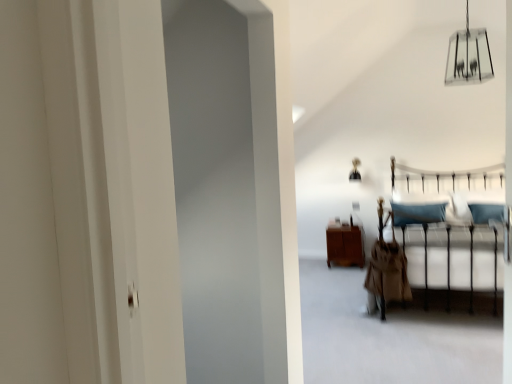
I want to click on clear glass chandelier at upper center, the first lamp viewed from the front, so click(x=468, y=56).

Locate an element on the screen. metallic gold lamp at upper center, which is the 1th lamp in back-to-front order is located at coordinates (355, 170).

Is brown wood cabinet at center looking in the opposite direction of metallic gold lamp at upper center, which is the 2th lamp from right to left?

That's not correct — brown wood cabinet at center is not looking away from metallic gold lamp at upper center, which is the 2th lamp from right to left.

From a real-world perspective, which is physically above, brown wood cabinet at center or metallic gold lamp at upper center, which is the 1th lamp in bottom-to-top order?

metallic gold lamp at upper center, which is the 1th lamp in bottom-to-top order, is physically above.

Considering the relative positions of brown wood cabinet at center and metallic gold lamp at upper center, the 2th lamp in the front-to-back sequence, in the image provided, is brown wood cabinet at center in front of metallic gold lamp at upper center, the 2th lamp in the front-to-back sequence,?

Yes, it is in front of metallic gold lamp at upper center, the 2th lamp in the front-to-back sequence.

This screenshot has height=384, width=512. I want to click on furniture on the left side of metallic gold lamp at upper center, which is the 1th lamp in back-to-front order, so click(x=345, y=244).

Which is nearer, (x=338, y=241) or (x=462, y=53)?

Point (x=338, y=241) is farther from the camera than point (x=462, y=53).

From a real-world perspective, count 2nd lamps upward from the brown wood cabinet at center and point to it. Please provide its 2D coordinates.

[(468, 56)]

Is brown wood cabinet at center positioned with its back to clear glass chandelier at upper center, the 2th lamp in the left-to-right sequence?

No.

Measure the distance from brown wood cabinet at center to clear glass chandelier at upper center, the 2th lamp viewed from the back.

brown wood cabinet at center is 7.55 feet from clear glass chandelier at upper center, the 2th lamp viewed from the back.

From a real-world perspective, is metallic gold lamp at upper center, which is the 2th lamp from right to left, over metallic silver bed frame at center?

Indeed, from a real-world perspective, metallic gold lamp at upper center, which is the 2th lamp from right to left, stands above metallic silver bed frame at center.

Considering the sizes of objects metallic gold lamp at upper center, which is the 1th lamp in back-to-front order, and metallic silver bed frame at center in the image provided, who is thinner, metallic gold lamp at upper center, which is the 1th lamp in back-to-front order, or metallic silver bed frame at center?

metallic gold lamp at upper center, which is the 1th lamp in back-to-front order.

Considering the positions of objects metallic gold lamp at upper center, positioned as the first lamp in left-to-right order, and metallic silver bed frame at center in the image provided, who is more to the right, metallic gold lamp at upper center, positioned as the first lamp in left-to-right order, or metallic silver bed frame at center?

Positioned to the right is metallic silver bed frame at center.

From the image's perspective, which object appears higher, metallic gold lamp at upper center, positioned as the first lamp in left-to-right order, or metallic silver bed frame at center?

metallic gold lamp at upper center, positioned as the first lamp in left-to-right order, from the image's perspective.

Could you tell me if metallic gold lamp at upper center, positioned as the first lamp in left-to-right order, is turned towards clear glass chandelier at upper center, the 2th lamp in the left-to-right sequence?

No, metallic gold lamp at upper center, positioned as the first lamp in left-to-right order, is not turned towards clear glass chandelier at upper center, the 2th lamp in the left-to-right sequence.

Considering the relative sizes of metallic gold lamp at upper center, the 2th lamp in the front-to-back sequence, and clear glass chandelier at upper center, arranged as the 1th lamp when viewed from the right, in the image provided, is metallic gold lamp at upper center, the 2th lamp in the front-to-back sequence, shorter than clear glass chandelier at upper center, arranged as the 1th lamp when viewed from the right,?

Yes.

At what (x,y) coordinates should I click in order to perform the action: click on lamp that appears on the left of clear glass chandelier at upper center, the 1th lamp in the top-to-bottom sequence. Please return your answer as a coordinate pair (x, y). The height and width of the screenshot is (384, 512). Looking at the image, I should click on (355, 170).

Which object is positioned more to the left, metallic gold lamp at upper center, positioned as the first lamp in left-to-right order, or clear glass chandelier at upper center, the 2th lamp in the left-to-right sequence?

From the viewer's perspective, metallic gold lamp at upper center, positioned as the first lamp in left-to-right order, appears more on the left side.

Can you confirm if clear glass chandelier at upper center, arranged as the 1th lamp when viewed from the right, is smaller than metallic silver bed frame at center?

Yes, clear glass chandelier at upper center, arranged as the 1th lamp when viewed from the right, is smaller than metallic silver bed frame at center.

Identify the location of bed frame on the right of clear glass chandelier at upper center, the 1th lamp in the top-to-bottom sequence. (452, 258).

How different are the orientations of clear glass chandelier at upper center, arranged as the 1th lamp when viewed from the right, and metallic silver bed frame at center in degrees?

3.72 degrees separate the facing orientations of clear glass chandelier at upper center, arranged as the 1th lamp when viewed from the right, and metallic silver bed frame at center.

Based on the photo, are clear glass chandelier at upper center, the 2th lamp in the left-to-right sequence, and brown wood cabinet at center far apart?

Indeed, clear glass chandelier at upper center, the 2th lamp in the left-to-right sequence, is not near brown wood cabinet at center.

From a real-world perspective, which object stands above the other?

In real-world perspective, clear glass chandelier at upper center, arranged as the second lamp when ordered from the bottom, is above.

Does point (481, 54) appear closer or farther from the camera than point (337, 253)?

Point (481, 54).

In order to click on lamp in front of the brown wood cabinet at center in this screenshot , I will do `click(468, 56)`.

Is metallic silver bed frame at center facing away from brown wood cabinet at center?

No.

Is metallic silver bed frame at center far away from brown wood cabinet at center?

Yes, metallic silver bed frame at center and brown wood cabinet at center are located far from each other.

Measure the distance from metallic silver bed frame at center to brown wood cabinet at center.

A distance of 1.83 meters exists between metallic silver bed frame at center and brown wood cabinet at center.

Considering the sizes of objects metallic silver bed frame at center and brown wood cabinet at center in the image provided, who is thinner, metallic silver bed frame at center or brown wood cabinet at center?

brown wood cabinet at center is thinner.

At what (x,y) coordinates should I click in order to perform the action: click on furniture lying on the left of metallic gold lamp at upper center, the 2th lamp in the front-to-back sequence. Please return your answer as a coordinate pair (x, y). This screenshot has width=512, height=384. Looking at the image, I should click on (345, 244).

Where is `the 2nd lamp above the brown wood cabinet at center (from the image's perspective)`? the 2nd lamp above the brown wood cabinet at center (from the image's perspective) is located at coordinates (468, 56).

Considering their positions, is brown wood cabinet at center positioned further to metallic gold lamp at upper center, which appears as the second lamp when viewed from the top, than metallic silver bed frame at center?

Among the two, metallic silver bed frame at center is located further to metallic gold lamp at upper center, which appears as the second lamp when viewed from the top.

Based on the photo, based on their spatial positions, is clear glass chandelier at upper center, the 2th lamp in the left-to-right sequence, or brown wood cabinet at center closer to metallic silver bed frame at center?

brown wood cabinet at center is closer to metallic silver bed frame at center.

From the image, which object appears to be farther from metallic silver bed frame at center, metallic gold lamp at upper center, which is the 1th lamp in back-to-front order, or clear glass chandelier at upper center, the 2th lamp viewed from the back?

The object further to metallic silver bed frame at center is metallic gold lamp at upper center, which is the 1th lamp in back-to-front order.

Estimate the real-world distances between objects in this image. Which object is further from metallic silver bed frame at center, clear glass chandelier at upper center, the 2th lamp in the left-to-right sequence, or metallic gold lamp at upper center, which appears as the second lamp when viewed from the top?

The object further to metallic silver bed frame at center is metallic gold lamp at upper center, which appears as the second lamp when viewed from the top.

Considering their positions, is metallic silver bed frame at center positioned further to clear glass chandelier at upper center, arranged as the second lamp when ordered from the bottom, than brown wood cabinet at center?

Among the two, brown wood cabinet at center is located further to clear glass chandelier at upper center, arranged as the second lamp when ordered from the bottom.

Which object lies further to the anchor point metallic gold lamp at upper center, which is the 1th lamp in back-to-front order, clear glass chandelier at upper center, arranged as the 1th lamp when viewed from the right, or brown wood cabinet at center?

The object further to metallic gold lamp at upper center, which is the 1th lamp in back-to-front order, is clear glass chandelier at upper center, arranged as the 1th lamp when viewed from the right.

When comparing their distances from metallic silver bed frame at center, does metallic gold lamp at upper center, which is the 2th lamp from right to left, or brown wood cabinet at center seem further?

Among the two, metallic gold lamp at upper center, which is the 2th lamp from right to left, is located further to metallic silver bed frame at center.

When comparing their distances from metallic gold lamp at upper center, the 2th lamp in the front-to-back sequence, does metallic silver bed frame at center or brown wood cabinet at center seem further?

Based on the image, metallic silver bed frame at center appears to be further to metallic gold lamp at upper center, the 2th lamp in the front-to-back sequence.

Where is `bed frame positioned between clear glass chandelier at upper center, the 2th lamp in the left-to-right sequence, and brown wood cabinet at center from near to far`? The image size is (512, 384). bed frame positioned between clear glass chandelier at upper center, the 2th lamp in the left-to-right sequence, and brown wood cabinet at center from near to far is located at coordinates (452, 258).

Where is `bed frame between clear glass chandelier at upper center, the 2th lamp viewed from the back, and metallic gold lamp at upper center, positioned as the first lamp in left-to-right order, in the front-back direction`? The height and width of the screenshot is (384, 512). bed frame between clear glass chandelier at upper center, the 2th lamp viewed from the back, and metallic gold lamp at upper center, positioned as the first lamp in left-to-right order, in the front-back direction is located at coordinates (452, 258).

At what (x,y) coordinates should I click in order to perform the action: click on furniture between metallic silver bed frame at center and metallic gold lamp at upper center, positioned as the first lamp in left-to-right order, from front to back. Please return your answer as a coordinate pair (x, y). Looking at the image, I should click on (345, 244).

Locate an element on the screen. The height and width of the screenshot is (384, 512). furniture between clear glass chandelier at upper center, arranged as the 1th lamp when viewed from the right, and metallic gold lamp at upper center, positioned as the first lamp in left-to-right order, along the z-axis is located at coordinates (345, 244).